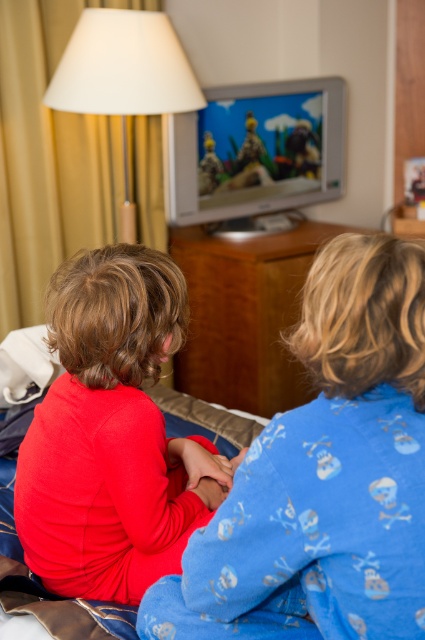
Between point (150, 308) and point (289, 243), which one is positioned in front?

Positioned in front is point (150, 308).

Measure the distance between point [170,513] and camera.

A distance of 1.23 meters exists between point [170,513] and camera.

Find the location of a particular element. matte red shirt at center is located at coordinates (112, 435).

Describe the element at coordinates (323, 476) in the screenshot. I see `red fleece shirt at center` at that location.

Who is more forward, (x=379, y=328) or (x=127, y=282)?

Point (x=379, y=328) is more forward.

Locate an element on the screen. This screenshot has width=425, height=640. red fleece shirt at center is located at coordinates (323, 476).

Is red fleece shirt at center below brown wood dresser at center?

Correct, red fleece shirt at center is located below brown wood dresser at center.

From the picture: Who is positioned more to the left, red fleece shirt at center or brown wood dresser at center?

red fleece shirt at center is more to the left.

Is point (376, 323) closer to camera compared to point (261, 308)?

Yes, point (376, 323) is in front of point (261, 308).

Find the location of a particular element. red fleece shirt at center is located at coordinates (323, 476).